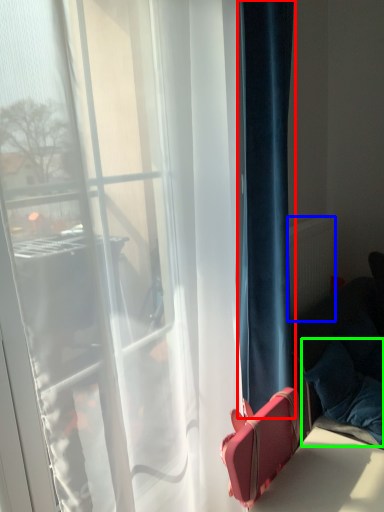
Question: Based on their relative distances, which object is nearer to curtain (highlighted by a red box)? Choose from radiator (highlighted by a blue box) and pillow (highlighted by a green box).

Choices:
 (A) radiator
 (B) pillow

Answer: (B)